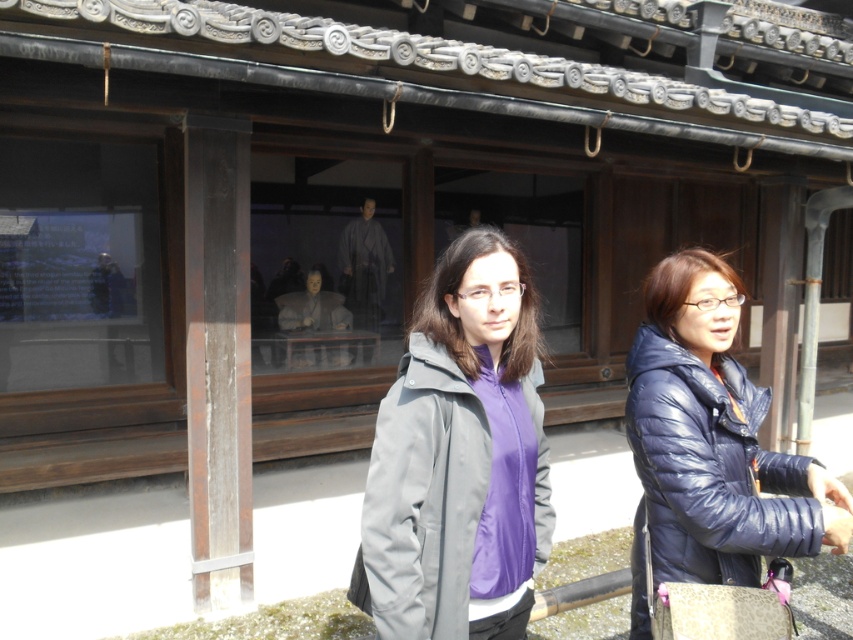
You are a photographer trying to capture a photo of both jackets. Since you need to ensure both are in frame, can you tell me the position of the matte gray jacket at center relative to the glossy blue jacket at right?

The matte gray jacket at center is positioned to the left of the glossy blue jacket at right, so both jackets will be in frame if you position your camera to include both the left and right sides.

You are an assistant helping someone choose jackets for a photoshoot. The scene shows two jackets in front of a traditional Japanese building. The matte gray jacket at center and the glossy blue jacket at right. Which jacket is positioned higher in the image?

The matte gray jacket at center is positioned higher than the glossy blue jacket at right in the image.

Based on the photo, you are trying to decide which jacket to buy based on their height. The scene shows a matte gray jacket at center and a glossy blue jacket at right. Which jacket is taller?

The glossy blue jacket at right is taller than the matte gray jacket at center.